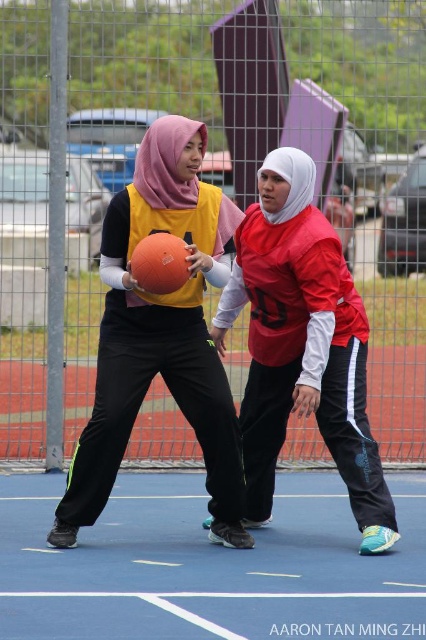
How distant is matte red jersey at center from orange matte basketball at center?

They are 4.54 feet apart.

Consider the image. Does matte red jersey at center appear over orange matte basketball at center?

No, matte red jersey at center is not above orange matte basketball at center.

Describe the element at coordinates (302, 346) in the screenshot. I see `matte red jersey at center` at that location.

Locate an element on the screen. The height and width of the screenshot is (640, 426). matte red jersey at center is located at coordinates (302, 346).

Who is taller, matte orange basketball at center or orange matte basketball at center?

Standing taller between the two is matte orange basketball at center.

Does matte orange basketball at center have a larger size compared to orange matte basketball at center?

Yes.

Locate an element on the screen. The width and height of the screenshot is (426, 640). matte orange basketball at center is located at coordinates (161, 333).

Who is positioned more to the left, matte orange basketball at center or matte red jersey at center?

Positioned to the left is matte orange basketball at center.

The image size is (426, 640). What do you see at coordinates (161, 333) in the screenshot?
I see `matte orange basketball at center` at bounding box center [161, 333].

This screenshot has width=426, height=640. Describe the element at coordinates (161, 333) in the screenshot. I see `matte orange basketball at center` at that location.

At what (x,y) coordinates should I click in order to perform the action: click on matte orange basketball at center. Please return your answer as a coordinate pair (x, y). The image size is (426, 640). Looking at the image, I should click on (161, 333).